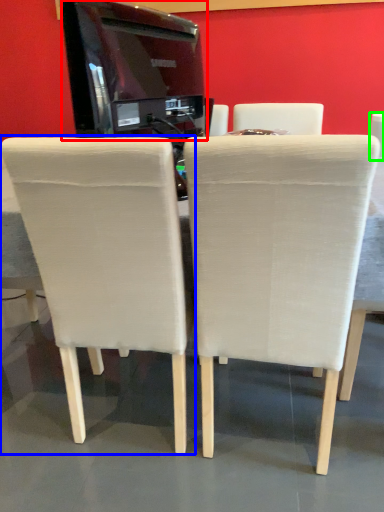
Question: Which object is the farthest from appliance (highlighted by a red box)? Choose among these: chair (highlighted by a blue box) or chair (highlighted by a green box).

Choices:
 (A) chair
 (B) chair

Answer: (B)